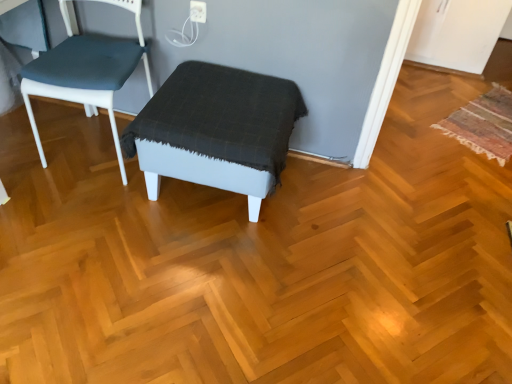
Question: In the image, is multicolored woven mat at right positioned in front of or behind matte blue fabric chair at left?

Choices:
 (A) front
 (B) behind

Answer: (B)

Question: Is multicolored woven mat at right taller or shorter than matte blue fabric chair at left?

Choices:
 (A) short
 (B) tall

Answer: (A)

Question: Which object is positioned closest to the multicolored woven mat at right?

Choices:
 (A) matte blue fabric chair at left
 (B) white plastic electric outlet at upper center
 (C) matte gray stool at center

Answer: (C)

Question: Which object is the farthest from the white plastic electric outlet at upper center?

Choices:
 (A) multicolored woven mat at right
 (B) matte gray stool at center
 (C) matte blue fabric chair at left

Answer: (A)